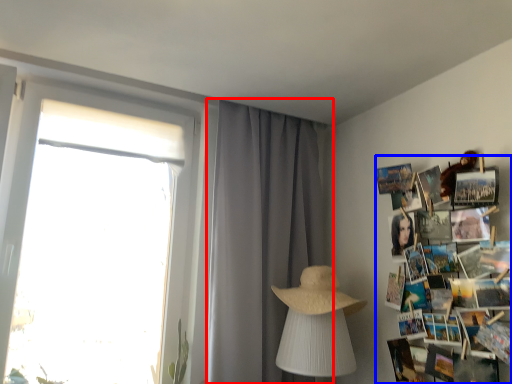
Question: Which of the following is the farthest to the observer, curtain (highlighted by a red box) or magazine (highlighted by a blue box)?

Choices:
 (A) curtain
 (B) magazine

Answer: (A)